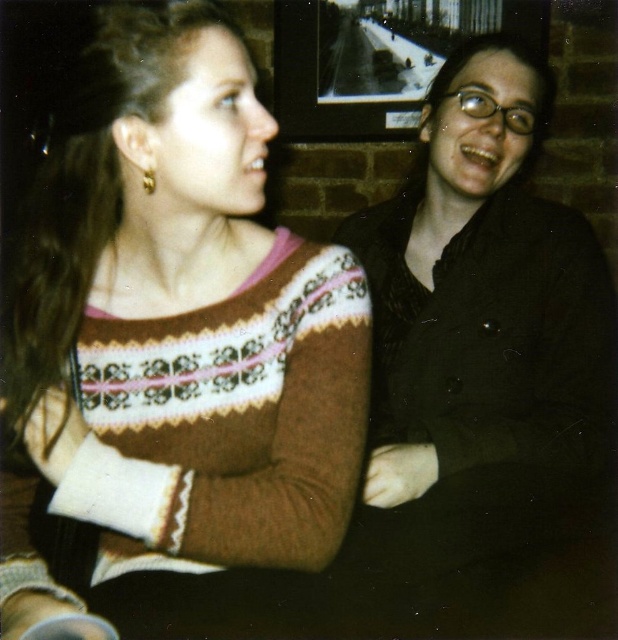
Question: Does brown knitted sweater at upper left lie in front of matte black jacket at center?

Choices:
 (A) no
 (B) yes

Answer: (B)

Question: Estimate the real-world distances between objects in this image. Which object is closer to the brown knitted sweater at upper left?

Choices:
 (A) gold metallic earring at upper left
 (B) matte black jacket at center

Answer: (A)

Question: Does matte black jacket at center appear over gold metallic earring at upper left?

Choices:
 (A) yes
 (B) no

Answer: (B)

Question: Which point is closer to the camera?

Choices:
 (A) matte black jacket at center
 (B) gold metallic earring at upper left
 (C) brown knitted sweater at upper left

Answer: (C)

Question: Can you confirm if brown knitted sweater at upper left is bigger than matte black jacket at center?

Choices:
 (A) yes
 (B) no

Answer: (B)

Question: Among these points, which one is farthest from the camera?

Choices:
 (A) (148, 188)
 (B) (538, 397)

Answer: (B)